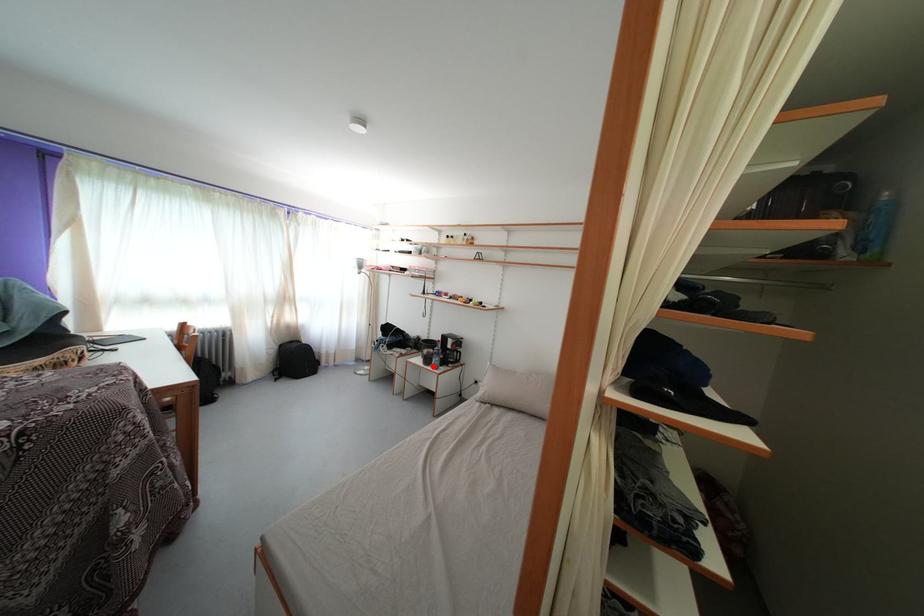
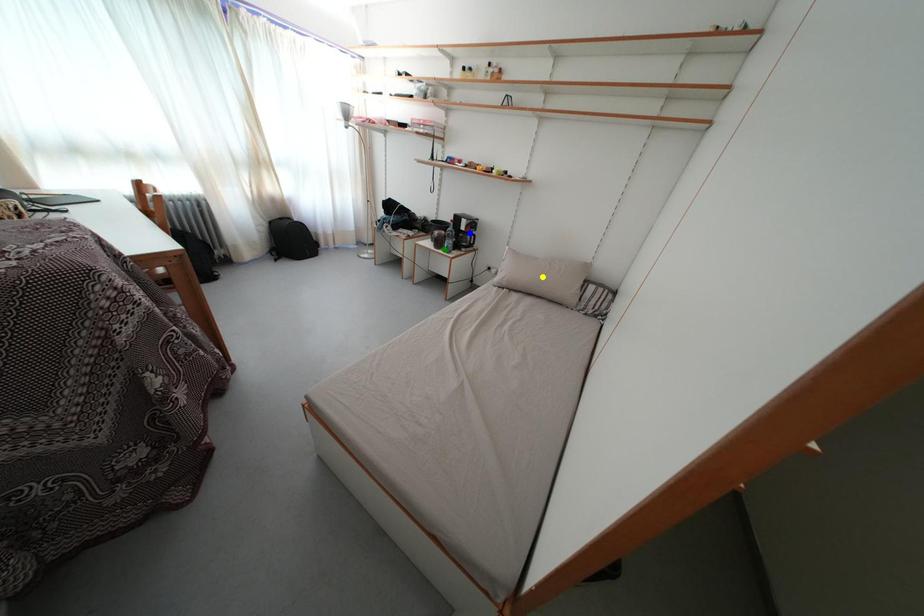
Question: I am providing you with two images of the same scene from different viewpoints. A red point is marked on the first image. You are given multiple points on the second image. Which point in image 2 is actually the same real-world point as the red point in image 1?

Choices:
 (A) yellow point
 (B) blue point
 (C) green point

Answer: (C)